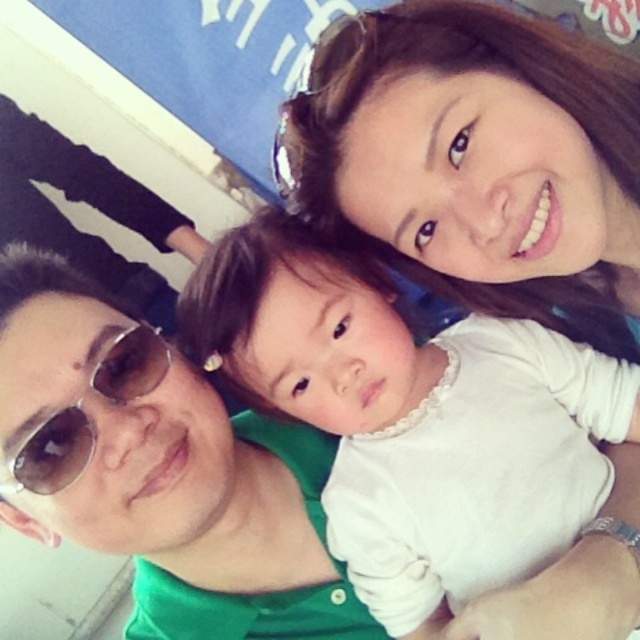
Question: Is sunglasses at left bigger than brown reflective sunglasses at left?

Choices:
 (A) yes
 (B) no

Answer: (A)

Question: Is white soft fabric at center bigger than brown reflective sunglasses at left?

Choices:
 (A) no
 (B) yes

Answer: (B)

Question: From the image, what is the correct spatial relationship of white soft fabric at center in relation to sunglasses at left?

Choices:
 (A) right
 (B) left

Answer: (A)

Question: Which of the following is the closest to the observer?

Choices:
 (A) sunglasses at left
 (B) brown reflective sunglasses at left

Answer: (B)

Question: Which of the following is the farthest from the observer?

Choices:
 (A) (45, 212)
 (B) (170, 358)

Answer: (A)

Question: Which point is closer to the camera taking this photo?

Choices:
 (A) (48, 129)
 (B) (138, 337)

Answer: (B)